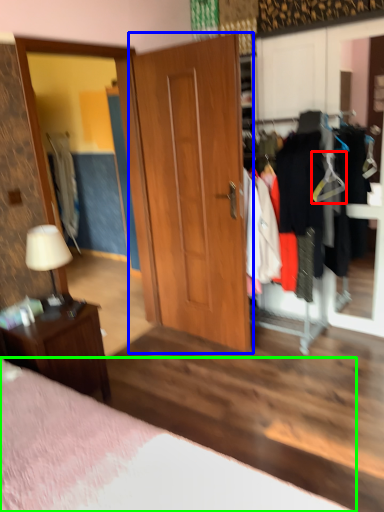
Question: Considering the real-world distances, which object is farthest from hanger (highlighted by a red box)? door (highlighted by a blue box) or bed (highlighted by a green box)?

Choices:
 (A) door
 (B) bed

Answer: (B)